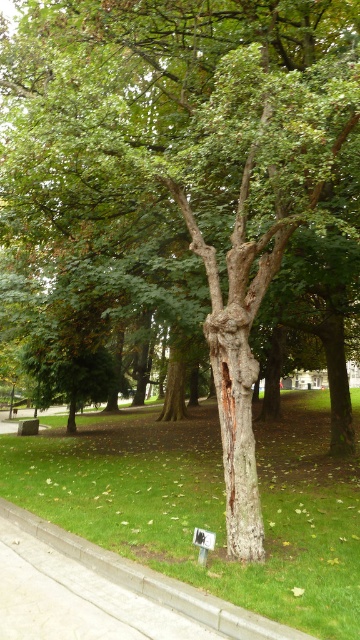
Question: Which object appears closest to the camera in this image?

Choices:
 (A) concrete at lower left
 (B) green grass at center

Answer: (A)

Question: Which object appears closest to the camera in this image?

Choices:
 (A) concrete at lower left
 (B) green grass at center

Answer: (A)

Question: Does green grass at center lie in front of concrete at lower left?

Choices:
 (A) no
 (B) yes

Answer: (A)

Question: Does green grass at center appear on the left side of concrete at lower left?

Choices:
 (A) yes
 (B) no

Answer: (B)

Question: Is green grass at center above concrete at lower left?

Choices:
 (A) no
 (B) yes

Answer: (A)